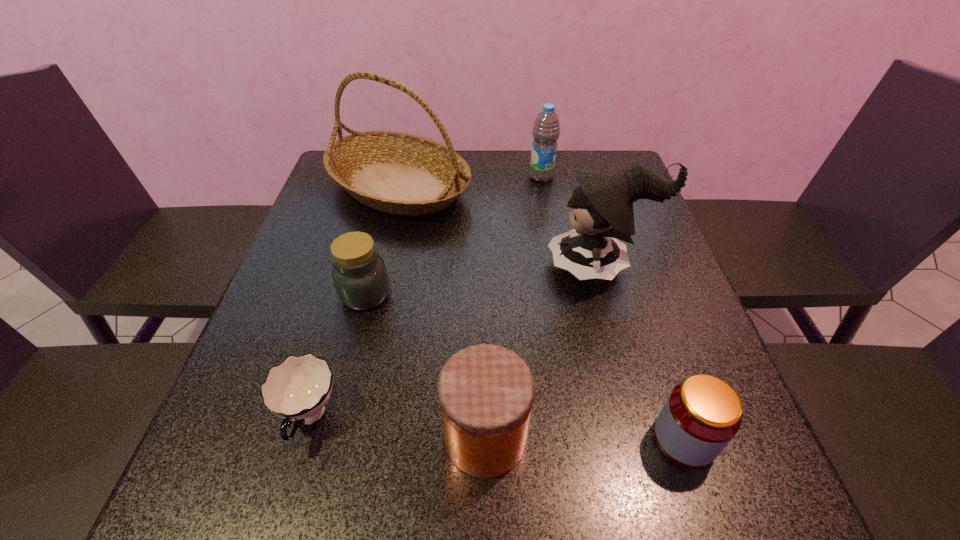
Where is `free space located at the face of the doll`? This screenshot has width=960, height=540. free space located at the face of the doll is located at coordinates (421, 266).

Identify the location of vacant space situated 0.140m at the face of the doll. The height and width of the screenshot is (540, 960). (487, 266).

Locate an element on the screen. This screenshot has width=960, height=540. free space located 0.340m on the left of the fifth shortest object is located at coordinates (412, 176).

In order to click on free space located on the left of the second jar from right to left in this screenshot , I will do `click(372, 437)`.

At what (x,y) coordinates should I click in order to perform the action: click on vacant position located on the front of the leftmost jar. Please return your answer as a coordinate pair (x, y). The height and width of the screenshot is (540, 960). Looking at the image, I should click on (344, 380).

You are a GUI agent. You are given a task and a screenshot of the screen. Output one action in this format:
    pyautogui.click(x=<x>, y=<y>)
    Task: Click on the vacant area situated on the back of the rightmost jar
    
    Given the screenshot: What is the action you would take?
    pyautogui.click(x=623, y=258)

Where is `blank space located 0.090m on the side of the shortest object with the handle`? Image resolution: width=960 pixels, height=540 pixels. blank space located 0.090m on the side of the shortest object with the handle is located at coordinates (279, 520).

Find the location of a particular element. basket that is at the far edge is located at coordinates (398, 173).

Find the location of a particular element. The height and width of the screenshot is (540, 960). water bottle that is at the far edge is located at coordinates (546, 130).

I want to click on basket at the left edge, so point(398,173).